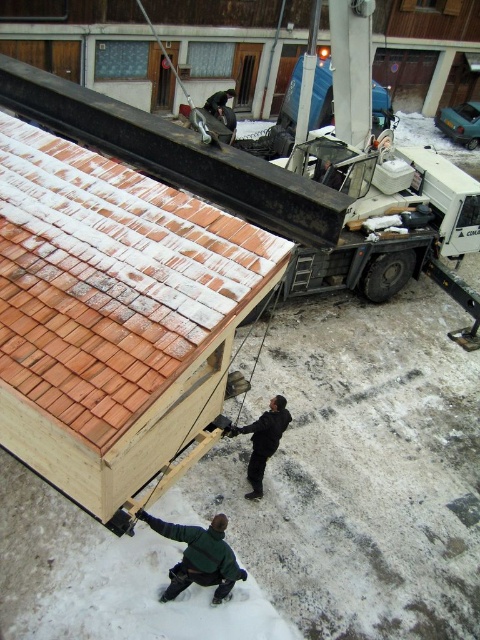
What do you see at coordinates (110, 282) in the screenshot? I see `brown shingles at upper left` at bounding box center [110, 282].

Does brown shingles at upper left appear over black matte jacket at center?

Indeed, brown shingles at upper left is positioned over black matte jacket at center.

This screenshot has height=640, width=480. What are the coordinates of `brown shingles at upper left` in the screenshot? It's located at (110, 282).

Locate an element on the screen. This screenshot has height=640, width=480. brown shingles at upper left is located at coordinates (110, 282).

Who is higher up, brown shingles at upper left or green matte jacket at lower center?

Positioned higher is brown shingles at upper left.

The width and height of the screenshot is (480, 640). Describe the element at coordinates (110, 282) in the screenshot. I see `brown shingles at upper left` at that location.

What are the coordinates of `brown shingles at upper left` in the screenshot? It's located at (110, 282).

Is green matte jacket at lower center smaller than black matte jacket at center?

Incorrect, green matte jacket at lower center is not smaller in size than black matte jacket at center.

Based on the photo, is green matte jacket at lower center positioned at the back of black matte jacket at center?

That is False.

Does point (217, 513) come in front of point (262, 435)?

No.

Identify the location of green matte jacket at lower center. (199, 556).